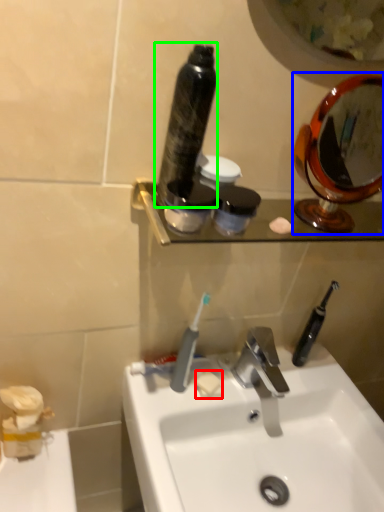
Question: Estimate the real-world distances between objects in this image. Which object is farther from soap (highlighted by a red box), mirror (highlighted by a blue box) or mouthwash (highlighted by a green box)?

Choices:
 (A) mirror
 (B) mouthwash

Answer: (A)